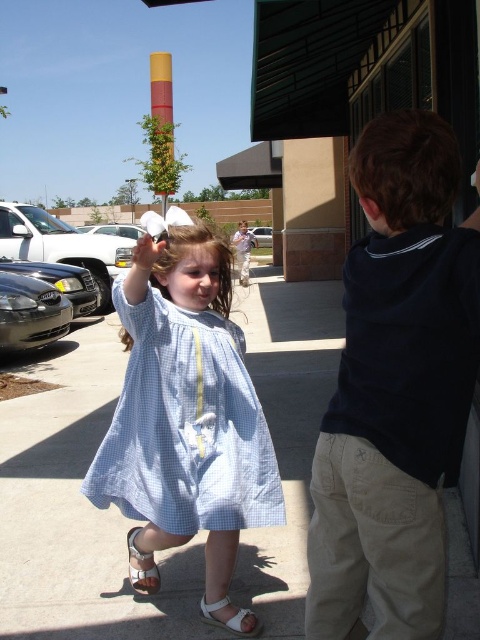
You are a photographer trying to capture the perfect shot of the light blue gingham dress at center and the matte white hand at center. If you want to ensure both are fully visible in the frame, which object should you focus on to avoid cropping?

The light blue gingham dress at center has a larger width than the matte white hand at center, so you should focus on ensuring the dress is fully visible to avoid cropping, as it takes up more space in the frame.

You are a photographer trying to capture the light blue gingham dress at center and the white fabric sandal at lower center in the same frame. Based on their positions, which object is closer to the left side of the frame?

The light blue gingham dress at center is to the left of the white fabric sandal at lower center, so the light blue gingham dress at center is closer to the left side of the frame.

You are standing at the center of the image. There is a point marked at coordinates point (192, 248). What object is located at that point?

The point (192, 248) marks brown smooth hair at center.